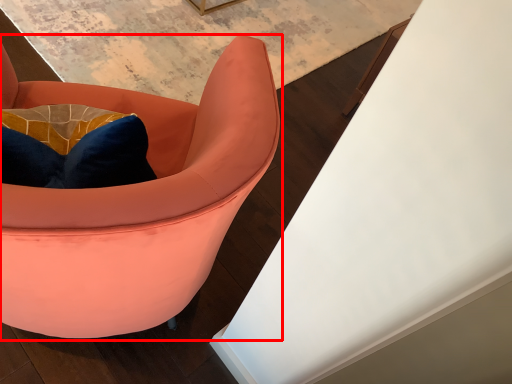
Question: Where is chair (annotated by the red box) located in relation to table in the image?

Choices:
 (A) right
 (B) left

Answer: (B)